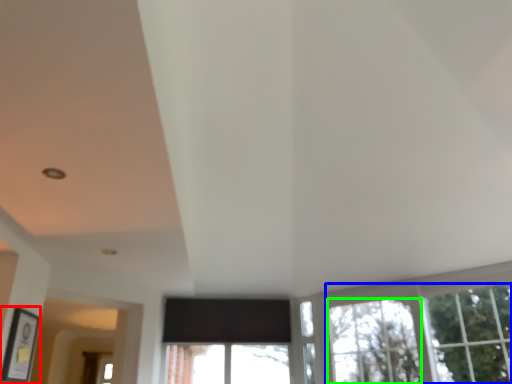
Question: Considering the real-world distances, which object is closest to picture frame (highlighted by a red box)? tree (highlighted by a blue box) or window (highlighted by a green box).

Choices:
 (A) tree
 (B) window

Answer: (B)